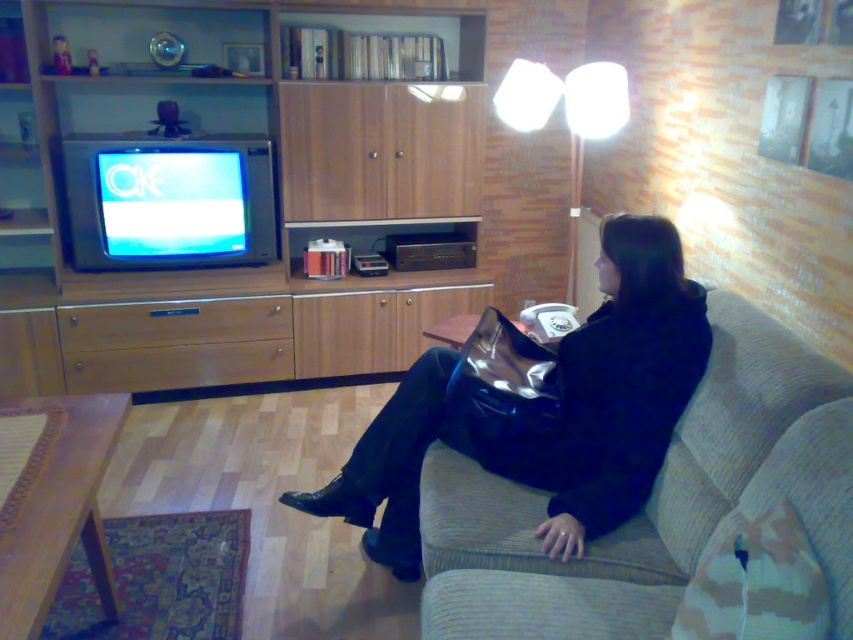
Question: Estimate the real-world distances between objects in this image. Which object is closer to the textured gray couch at right?

Choices:
 (A) black leather jacket at center
 (B) brown wood entertainment center at left
 (C) white fabric lamp at upper center

Answer: (A)

Question: Can you confirm if brown wood entertainment center at left is wider than textured gray couch at right?

Choices:
 (A) no
 (B) yes

Answer: (B)

Question: Where is textured gray couch at right located in relation to white fabric lamp at upper center in the image?

Choices:
 (A) right
 (B) left

Answer: (B)

Question: Which object is closer to the camera taking this photo?

Choices:
 (A) textured gray couch at right
 (B) brown wood entertainment center at left
 (C) white fabric lamp at upper center
 (D) black leather jacket at center

Answer: (A)

Question: Which object appears closest to the camera in this image?

Choices:
 (A) white fabric lamp at upper center
 (B) brown wood entertainment center at left

Answer: (A)

Question: Is brown wood entertainment center at left thinner than black leather jacket at center?

Choices:
 (A) yes
 (B) no

Answer: (B)